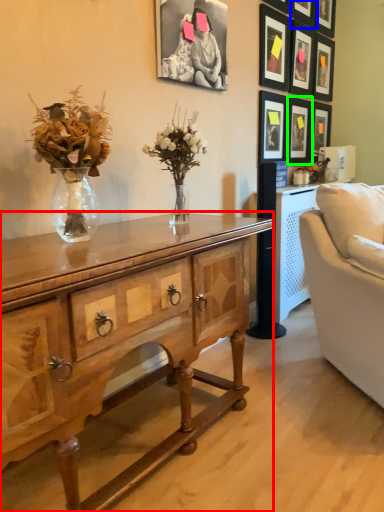
Question: Which object is the farthest from desk (highlighted by a red box)? Choose among these: picture frame (highlighted by a blue box) or picture frame (highlighted by a green box).

Choices:
 (A) picture frame
 (B) picture frame

Answer: (A)